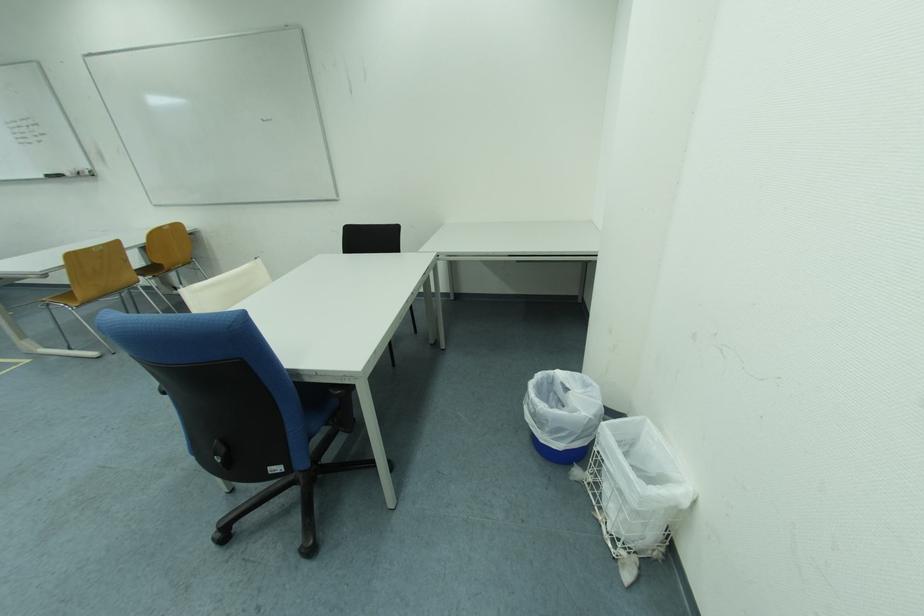
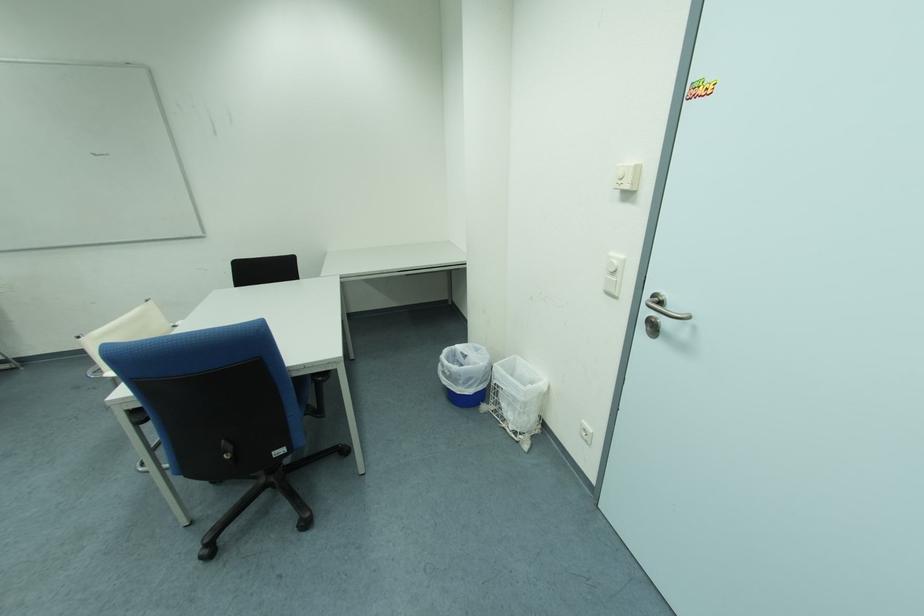
The point at (594, 387) is marked in the first image. Where is the corresponding point in the second image?

(485, 352)